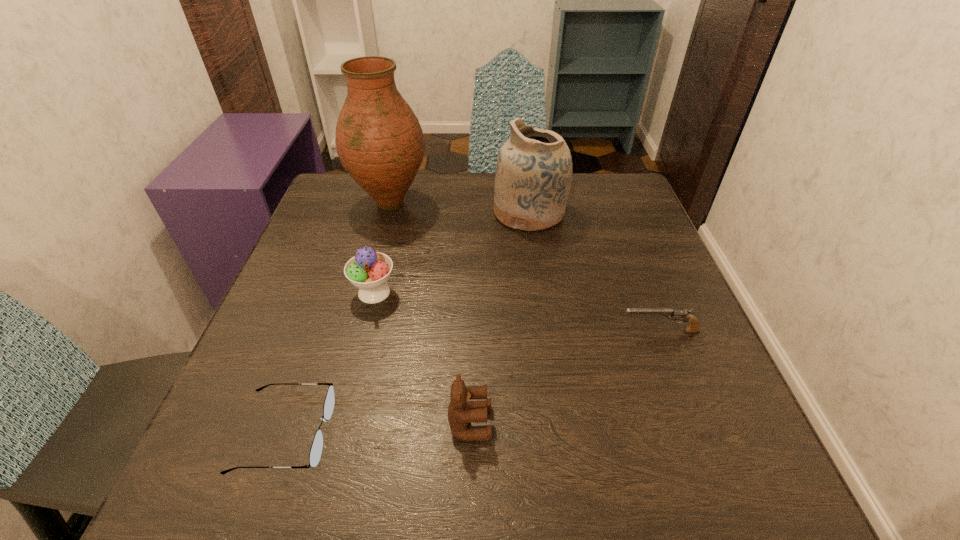
Image resolution: width=960 pixels, height=540 pixels. I want to click on vacant space located on the right of the fourth nearest object, so click(x=461, y=292).

At what (x,y) coordinates should I click in order to perform the action: click on vacant space located on the face of the teddy bear. Please return your answer as a coordinate pair (x, y). Image resolution: width=960 pixels, height=540 pixels. Looking at the image, I should click on (723, 423).

Image resolution: width=960 pixels, height=540 pixels. In order to click on vacant space located 0.050m aiming along the barrel of the second shortest object in this screenshot , I will do `click(593, 332)`.

What are the coordinates of `free region located 0.250m aiming along the barrel of the second shortest object` in the screenshot? It's located at (486, 332).

In order to click on vacant area situated aiming along the barrel of the second shortest object in this screenshot , I will do pyautogui.click(x=529, y=332).

Image resolution: width=960 pixels, height=540 pixels. Identify the location of free region located 0.330m on the lenses of the shortest object. (544, 433).

Image resolution: width=960 pixels, height=540 pixels. What are the coordinates of `vase positioned at the far edge` in the screenshot? It's located at (379, 141).

Locate an element on the screen. This screenshot has width=960, height=540. pottery positioned at the far edge is located at coordinates (533, 178).

Identify the location of teddy bear that is at the near edge. The height and width of the screenshot is (540, 960). (461, 411).

This screenshot has width=960, height=540. Find the location of `spectacles located at the near edge`. spectacles located at the near edge is located at coordinates (315, 454).